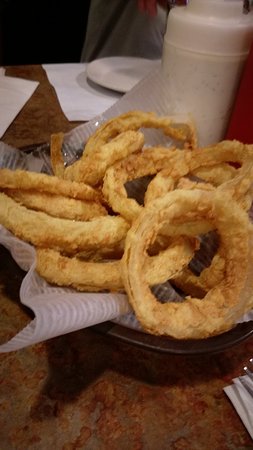
Locate an element on the screen. The height and width of the screenshot is (450, 253). paper liner is located at coordinates (56, 321).